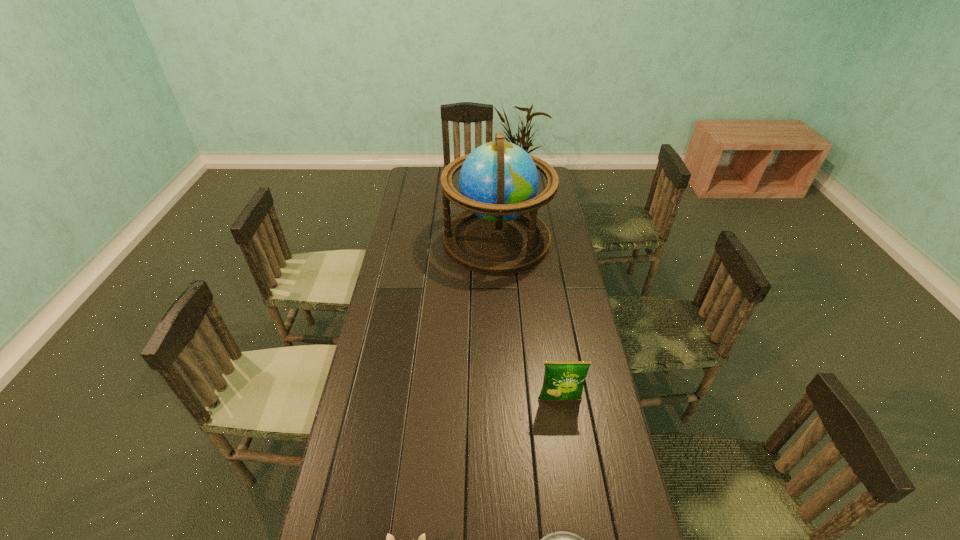
The width and height of the screenshot is (960, 540). I want to click on the farthest object, so click(x=499, y=233).

Find the location of `the tallest object`. the tallest object is located at coordinates (499, 233).

This screenshot has height=540, width=960. In order to click on the third nearest object in this screenshot , I will do `click(563, 380)`.

Locate an element on the screen. the second tallest object is located at coordinates (563, 380).

I want to click on vacant space located 0.090m on the back of the farthest object, so click(495, 200).

Locate an element on the screen. This screenshot has height=540, width=960. free spot located on the front-facing side of the third shortest object is located at coordinates (568, 455).

Locate an element on the screen. The width and height of the screenshot is (960, 540). globe that is at the right edge is located at coordinates (499, 233).

Where is `crisp (potato chip) that is at the right edge`? crisp (potato chip) that is at the right edge is located at coordinates (563, 380).

Locate an element on the screen. This screenshot has height=540, width=960. free space at the left edge is located at coordinates (378, 436).

At what (x,y) coordinates should I click in order to perform the action: click on free space at the right edge. Please return your answer as a coordinate pair (x, y). Looking at the image, I should click on (574, 286).